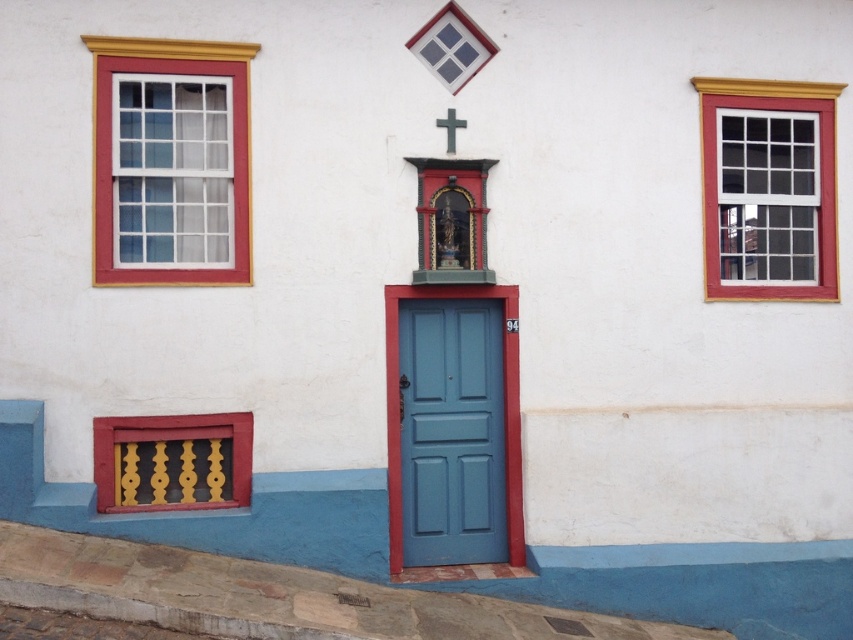
Can you confirm if blue matte door at center is smaller than white matte cross at upper center?

No.

Locate an element on the screen. The width and height of the screenshot is (853, 640). blue matte door at center is located at coordinates (451, 432).

At what (x,y) coordinates should I click in order to perform the action: click on blue matte door at center. Please return your answer as a coordinate pair (x, y). Looking at the image, I should click on (451, 432).

Can you confirm if matte white glass window at left is smaller than white matte cross at upper center?

Incorrect, matte white glass window at left is not smaller in size than white matte cross at upper center.

Is matte white glass window at left below white matte cross at upper center?

Yes, matte white glass window at left is below white matte cross at upper center.

Where is `matte white glass window at left`? Image resolution: width=853 pixels, height=640 pixels. matte white glass window at left is located at coordinates (171, 161).

Can you confirm if white glass window at right is positioned below blue matte door at center?

No, white glass window at right is not below blue matte door at center.

Between white glass window at right and blue matte door at center, which one appears on the left side from the viewer's perspective?

From the viewer's perspective, blue matte door at center appears more on the left side.

Which is behind, point (727, 156) or point (468, 378)?

Positioned behind is point (727, 156).

I want to click on white glass window at right, so click(x=769, y=188).